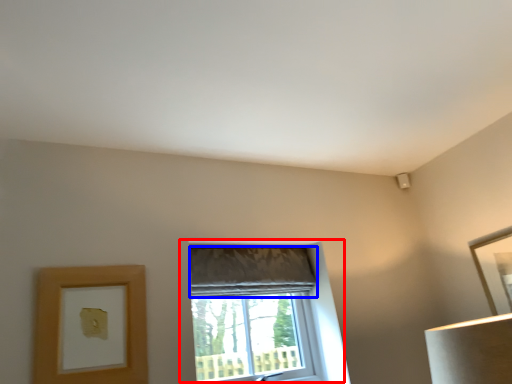
Question: Which point is closer to the camera, window (highlighted by a red box) or curtain (highlighted by a blue box)?

Choices:
 (A) window
 (B) curtain

Answer: (A)